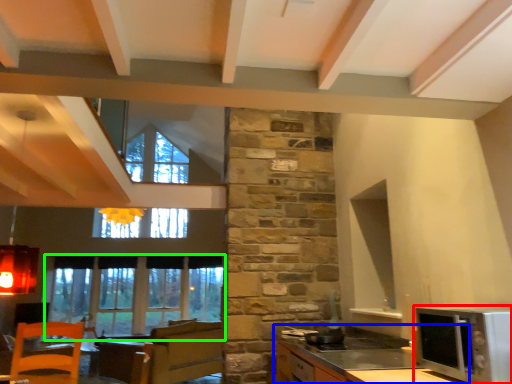
Question: Which object is positioned closest to microwave oven (highlighted by a red box)? Select from cabinetry (highlighted by a blue box) and window (highlighted by a green box).

Choices:
 (A) cabinetry
 (B) window

Answer: (A)